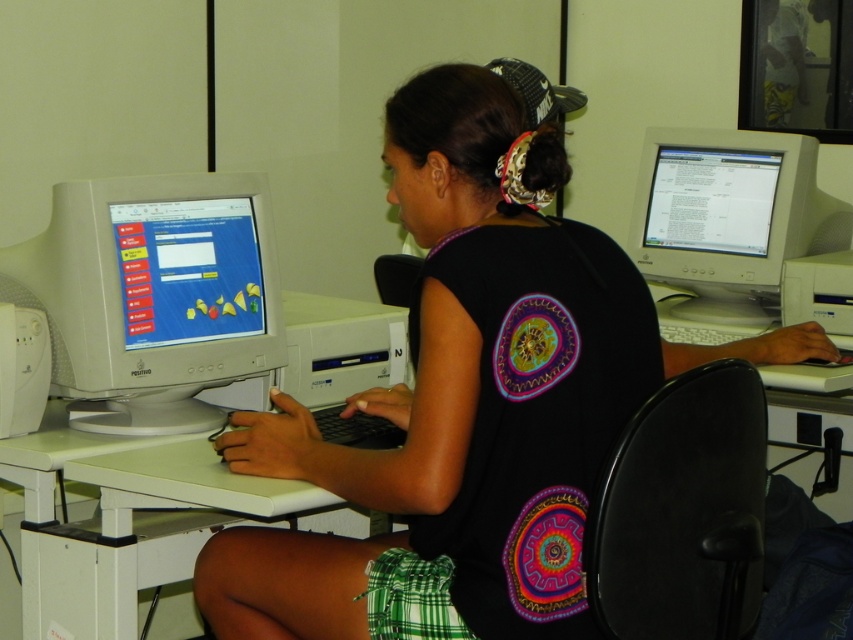
Question: Is white glossy computer monitor at left to the left of white plastic computer desk at center from the viewer's perspective?

Choices:
 (A) no
 (B) yes

Answer: (B)

Question: Is the position of black plastic chair at center less distant than that of white plastic monitor at right?

Choices:
 (A) yes
 (B) no

Answer: (A)

Question: Which of the following is the closest to the observer?

Choices:
 (A) white plastic monitor at right
 (B) white glossy computer monitor at left
 (C) white plastic computer desk at center
 (D) matte black shirt at center

Answer: (D)

Question: Which object is the farthest from the white plastic monitor at right?

Choices:
 (A) black plastic chair at center
 (B) white glossy computer monitor at left
 (C) matte black shirt at center

Answer: (B)

Question: Which object is positioned closest to the white glossy computer monitor at left?

Choices:
 (A) white plastic computer desk at center
 (B) matte black shirt at center

Answer: (A)

Question: Does black plastic chair at center appear on the right side of white plastic monitor at right?

Choices:
 (A) yes
 (B) no

Answer: (B)